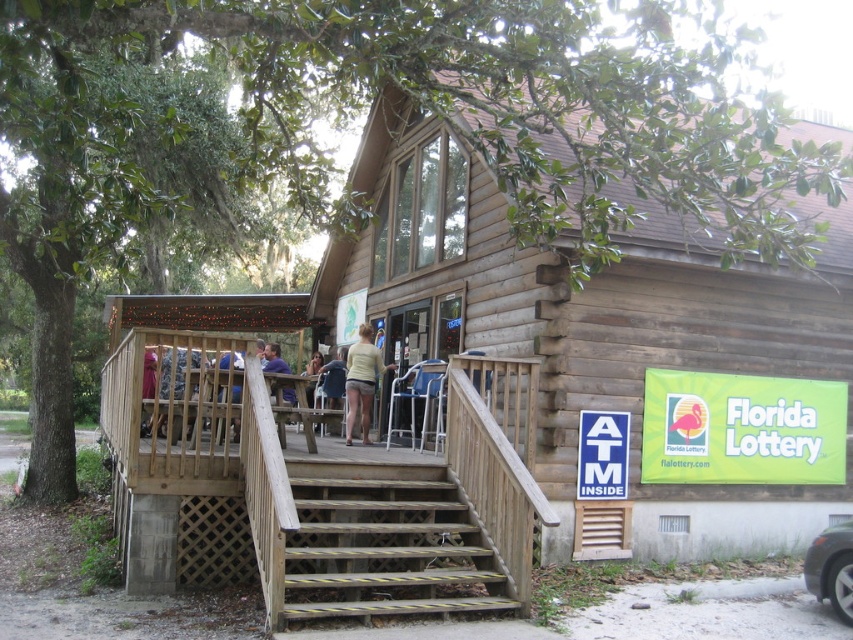
Question: Which object is the closest to the light yellow fabric shorts at center?

Choices:
 (A) wooden at lower left
 (B) wooden cabin at center

Answer: (B)

Question: Can you confirm if yellow-striped wood stairs at lower center is positioned above blue denim shirt at center?

Choices:
 (A) yes
 (B) no

Answer: (B)

Question: From the image, what is the correct spatial relationship of wooden cabin at center in relation to dark blue jeans at left?

Choices:
 (A) left
 (B) right

Answer: (B)

Question: Which object is farther from the camera taking this photo?

Choices:
 (A) light yellow fabric shorts at center
 (B) blue denim shirt at center
 (C) wooden cabin at center
 (D) wooden at lower left

Answer: (B)

Question: Considering the real-world distances, which object is farthest from the blue denim shirt at center?

Choices:
 (A) wooden cabin at center
 (B) light yellow fabric shorts at center
 (C) dark blue jeans at left
 (D) wooden at lower left

Answer: (A)

Question: Is wooden at lower left positioned at the back of light yellow fabric shorts at center?

Choices:
 (A) no
 (B) yes

Answer: (A)